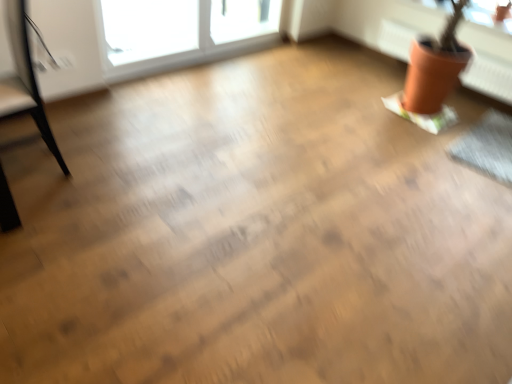
What do you see at coordinates (489, 14) in the screenshot? I see `transparent glass window screen at upper right` at bounding box center [489, 14].

The width and height of the screenshot is (512, 384). Find the location of `terracotta clay pot at upper right`. terracotta clay pot at upper right is located at coordinates (489, 76).

Considering the sizes of objects black leather armchair at left and transparent glass window screen at upper right in the image provided, who is bigger, black leather armchair at left or transparent glass window screen at upper right?

With larger size is black leather armchair at left.

Which is behind, point (19, 95) or point (437, 11)?

The point (437, 11) is more distant.

Is black leather armchair at left far away from transparent glass window screen at upper right?

That's right, there is a large distance between black leather armchair at left and transparent glass window screen at upper right.

From a real-world perspective, who is located lower, black leather armchair at left or transparent glass window screen at upper right?

black leather armchair at left is physically lower.

Is black leather armchair at left positioned in front of terracotta clay pot at upper right?

Yes, black leather armchair at left is in front of terracotta clay pot at upper right.

Which object is positioned more to the right, black leather armchair at left or terracotta clay pot at upper right?

terracotta clay pot at upper right is more to the right.

Is black leather armchair at left spatially inside terracotta clay pot at upper right, or outside of it?

black leather armchair at left cannot be found inside terracotta clay pot at upper right.

Which of these two, transparent glass window screen at upper right or terracotta clay pot at upper right, is wider?

Wider between the two is terracotta clay pot at upper right.

From the image's perspective, between transparent glass window screen at upper right and terracotta clay pot at upper right, which one is located above?

transparent glass window screen at upper right appears higher in the image.

Based on their sizes in the image, would you say transparent glass window screen at upper right is bigger or smaller than terracotta clay pot at upper right?

Considering their sizes, transparent glass window screen at upper right takes up less space than terracotta clay pot at upper right.

Locate an element on the screen. The width and height of the screenshot is (512, 384). radiator located on the left of transparent glass window screen at upper right is located at coordinates (489, 76).

Between terracotta clay pot at upper right and transparent glass window screen at upper right, which one appears on the right side from the viewer's perspective?

Positioned to the right is transparent glass window screen at upper right.

Is terracotta clay pot at upper right behind transparent glass window screen at upper right?

No, terracotta clay pot at upper right is closer to the viewer.

Who is bigger, terracotta clay pot at upper right or transparent glass window screen at upper right?

With larger size is terracotta clay pot at upper right.

Is terracotta clay pot at upper right thinner than transparent glass window screen at upper right?

In fact, terracotta clay pot at upper right might be wider than transparent glass window screen at upper right.

From a real-world perspective, is terracotta clay pot at upper right on black leather armchair at left?

Actually, terracotta clay pot at upper right is physically below black leather armchair at left in the real world.

Measure the distance between terracotta clay pot at upper right and black leather armchair at left.

They are 8.81 feet apart.

Is terracotta clay pot at upper right bigger than black leather armchair at left?

No.

Between transparent glass window screen at upper right and black leather armchair at left, which one has less height?

transparent glass window screen at upper right.

Image resolution: width=512 pixels, height=384 pixels. What are the coordinates of `armchair that is below the transparent glass window screen at upper right (from the image's perspective)` in the screenshot? It's located at (25, 81).

Is point (470, 12) closer to viewer compared to point (37, 110)?

No.

Locate an element on the screen. The width and height of the screenshot is (512, 384). armchair on the left side of transparent glass window screen at upper right is located at coordinates (25, 81).

The image size is (512, 384). In the image, there is a black leather armchair at left. What are the coordinates of `radiator below it (from a real-world perspective)` in the screenshot? It's located at (489, 76).

Which object lies further to the anchor point terracotta clay pot at upper right, black leather armchair at left or transparent glass window screen at upper right?

black leather armchair at left is further to terracotta clay pot at upper right.

Which object lies nearer to the anchor point transparent glass window screen at upper right, black leather armchair at left or terracotta clay pot at upper right?

terracotta clay pot at upper right is closer to transparent glass window screen at upper right.

Estimate the real-world distances between objects in this image. Which object is further from terracotta clay pot at upper right, transparent glass window screen at upper right or black leather armchair at left?

black leather armchair at left is positioned further to the anchor terracotta clay pot at upper right.

Considering their positions, is terracotta clay pot at upper right positioned further to black leather armchair at left than transparent glass window screen at upper right?

The object further to black leather armchair at left is transparent glass window screen at upper right.

Looking at the image, which one is located closer to transparent glass window screen at upper right, terracotta clay pot at upper right or black leather armchair at left?

terracotta clay pot at upper right is positioned closer to the anchor transparent glass window screen at upper right.

Looking at the image, which one is located closer to black leather armchair at left, transparent glass window screen at upper right or terracotta clay pot at upper right?

terracotta clay pot at upper right is closer to black leather armchair at left.

Find the location of `radiator located between black leather armchair at left and transparent glass window screen at upper right in the left-right direction`. radiator located between black leather armchair at left and transparent glass window screen at upper right in the left-right direction is located at coordinates (489, 76).